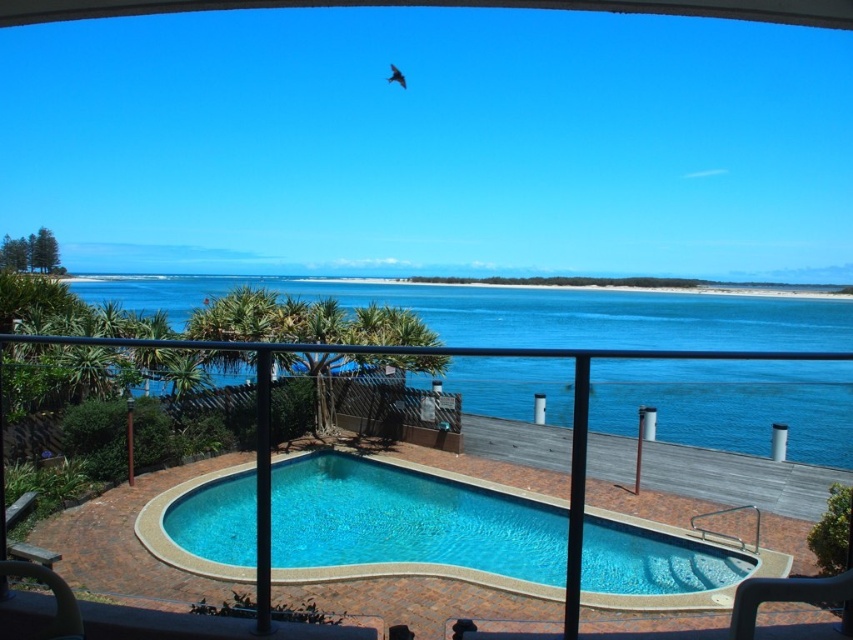
Question: Which point is farther to the camera?

Choices:
 (A) (502, 490)
 (B) (491, 378)

Answer: (B)

Question: Considering the real-world distances, which object is farthest from the blue concrete pool at center?

Choices:
 (A) blue water at center
 (B) smooth wood deck at center

Answer: (A)

Question: Among these objects, which one is nearest to the camera?

Choices:
 (A) blue concrete pool at center
 (B) smooth wood deck at center
 (C) blue water at center

Answer: (B)

Question: Can you confirm if blue water at center is thinner than smooth wood deck at center?

Choices:
 (A) no
 (B) yes

Answer: (A)

Question: Is blue concrete pool at center wider than smooth wood deck at center?

Choices:
 (A) no
 (B) yes

Answer: (A)

Question: Does blue water at center have a smaller size compared to smooth wood deck at center?

Choices:
 (A) yes
 (B) no

Answer: (B)